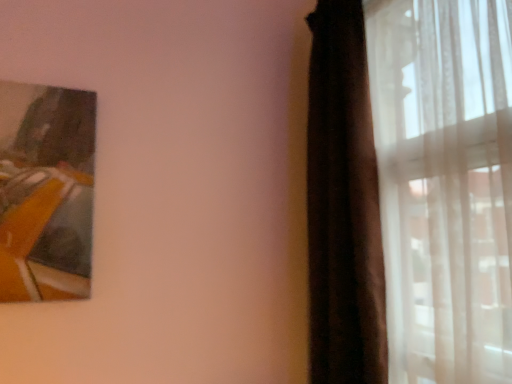
Question: Is silky white curtain at right, which is counted as the second curtain, starting from the left, in front of or behind brown velvet curtain at right, marked as the 2th curtain in a right-to-left arrangement, in the image?

Choices:
 (A) behind
 (B) front

Answer: (B)

Question: Is silky white curtain at right, arranged as the first curtain when viewed from the right, spatially inside brown velvet curtain at right, the first curtain viewed from the left, or outside of it?

Choices:
 (A) outside
 (B) inside

Answer: (B)

Question: Based on their sizes in the image, would you say silky white curtain at right, which is counted as the second curtain, starting from the left, is bigger or smaller than brown velvet curtain at right, the first curtain viewed from the left?

Choices:
 (A) big
 (B) small

Answer: (A)

Question: Is point (348, 135) closer or farther from the camera than point (438, 344)?

Choices:
 (A) closer
 (B) farther

Answer: (B)

Question: Considering the positions of brown velvet curtain at right, the first curtain viewed from the left, and silky white curtain at right, arranged as the first curtain when viewed from the right, in the image, is brown velvet curtain at right, the first curtain viewed from the left, taller or shorter than silky white curtain at right, arranged as the first curtain when viewed from the right,?

Choices:
 (A) short
 (B) tall

Answer: (B)

Question: Which is correct: brown velvet curtain at right, the first curtain viewed from the left, is inside silky white curtain at right, arranged as the first curtain when viewed from the right, or outside of it?

Choices:
 (A) outside
 (B) inside

Answer: (B)

Question: In the image, is brown velvet curtain at right, marked as the 2th curtain in a right-to-left arrangement, positioned in front of or behind silky white curtain at right, which is counted as the second curtain, starting from the left?

Choices:
 (A) behind
 (B) front

Answer: (A)